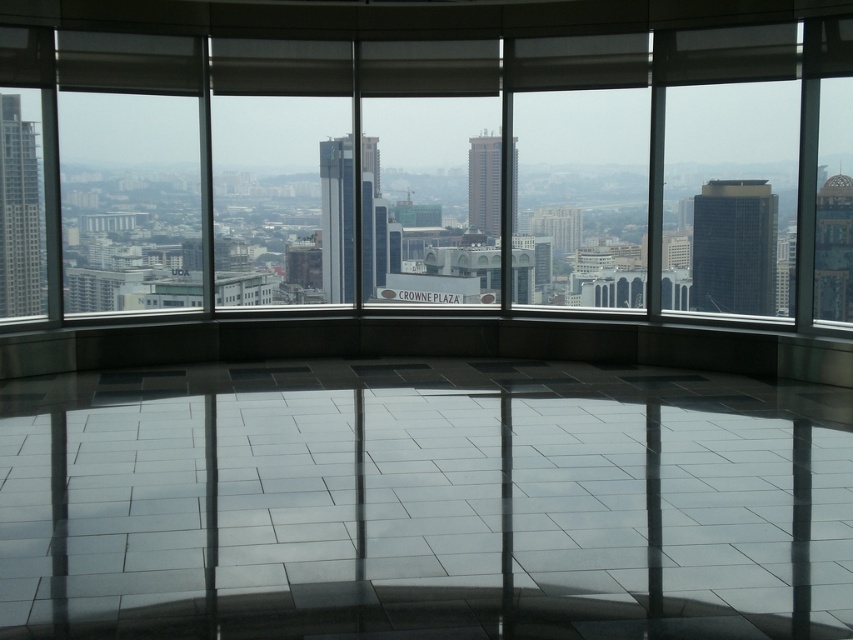
You are an architect evaluating two glass towers visible from the observation deck. The black glass tower at right and the matte glass tower at center. Which one appears to be the taller structure when viewed from this vantage point?

The matte glass tower at center is taller than the black glass tower at right.

You are an architect designing a new building and want to ensure it aligns with the scale of the existing structures. Given the scene, which of the two buildings, the matte glass skyscraper at left or the matte glass tower at center, should you reference for a larger building design?

The matte glass skyscraper at left is larger than the matte glass tower at center, so you should reference the matte glass skyscraper at left for a larger building design.

You are standing on the observation deck and want to take a photo of the black glass tower at right. To ensure the tower is centered in your shot, where should you position yourself relative to the floor tiles?

The black glass tower at right is located at point coordinates of (734, 248). To center it in your photo, you should position yourself so that the tower aligns with the center point of the floor tiles.